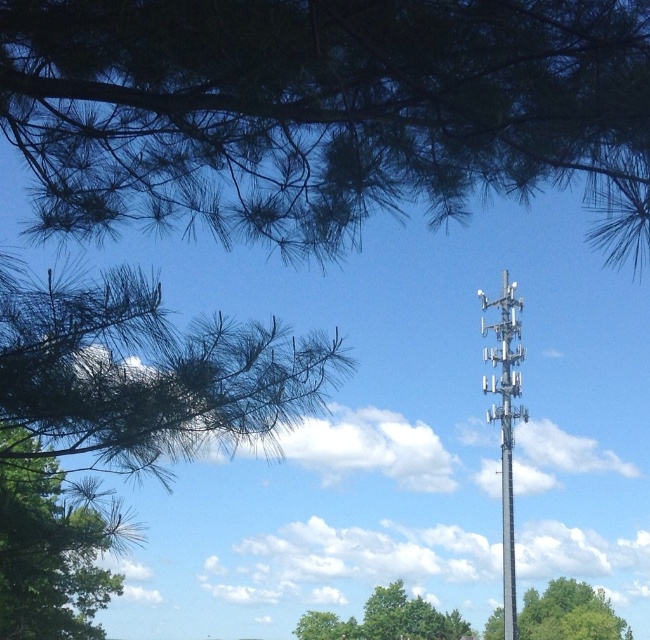
Question: Which object is the farthest from the green leafy tree at lower right?

Choices:
 (A) green matte tree at upper left
 (B) silver metallic pole at upper right

Answer: (A)

Question: In this image, where is green matte tree at upper left located relative to green leafy tree at lower right?

Choices:
 (A) below
 (B) above

Answer: (B)

Question: Which of these objects is positioned farthest from the silver metallic pole at upper right?

Choices:
 (A) green needle-like branches at upper left
 (B) green leafy tree at center
 (C) green matte tree at upper left
 (D) green leafy tree at lower right

Answer: (A)

Question: Can you confirm if green needle-like branches at upper left is positioned above green leafy tree at lower right?

Choices:
 (A) yes
 (B) no

Answer: (A)

Question: Is green needle-like branches at upper left positioned before green leafy tree at lower right?

Choices:
 (A) yes
 (B) no

Answer: (A)

Question: Which point is farther from the camera taking this photo?

Choices:
 (A) (520, 419)
 (B) (443, 620)

Answer: (B)